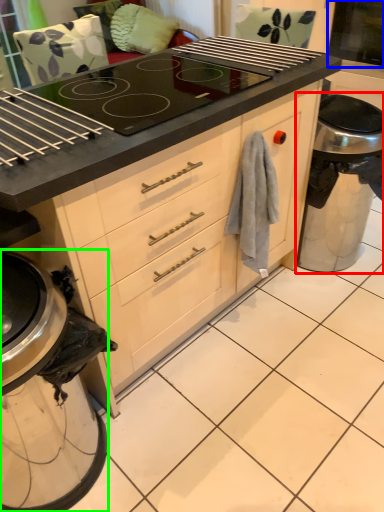
Question: Based on their relative distances, which object is farther from appliance (highlighted by a red box)? Choose from screen door (highlighted by a blue box) and kitchen appliance (highlighted by a green box).

Choices:
 (A) screen door
 (B) kitchen appliance

Answer: (B)